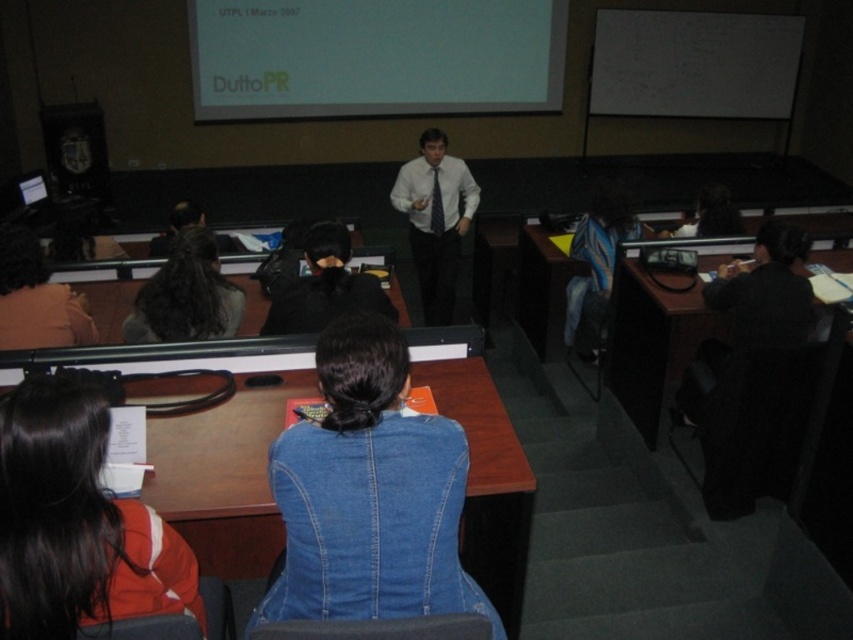
You are a student who just entered the classroom and need to sit at the wooden desk at center. Considering your height is 1.6 meters, will you be able to comfortably reach the desk surface?

The distance between you and the wooden desk at center is 1.89 meters. Since this distance is greater than your height of 1.6 meters, you might have difficulty comfortably reaching the desk surface without moving closer.

You are a photographer in the classroom and want to take a photo of both the denim jacket at center and the black matte jacket at center. Which jacket should you focus on first if you want to capture both clearly in the same frame?

The denim jacket at center is located below the black matte jacket at center, so you should focus on the black matte jacket at center first to ensure both are in focus since it is closer to the camera.